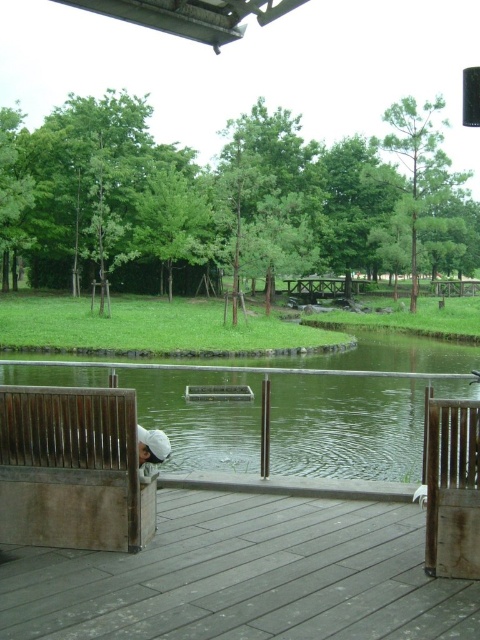
You are planning to host a small gathering at the park and need to seat guests. You have two brown wooden benches available. Which bench, the brown wooden bench at lower left or the brown wooden bench at right, can accommodate more people due to its size?

The brown wooden bench at lower left can accommodate more people because its width surpasses that of the brown wooden bench at right.

You are standing at the edge of the wooden deck at lower center and want to walk to the brown wooden bench at right. Which direction should you move to reach it?

Since the wooden deck at lower center is closer to the viewer than the brown wooden bench at right, you should move forward away from the viewer to reach the brown wooden bench at right.

You are standing at the wooden deck overlooking the water and want to locate two specific points. The first point is at coordinates point (232,568) and the second point is at point (82,484). Which of these two points is closer to you?

Point (232,568) is closer to the viewer than point (82,484).